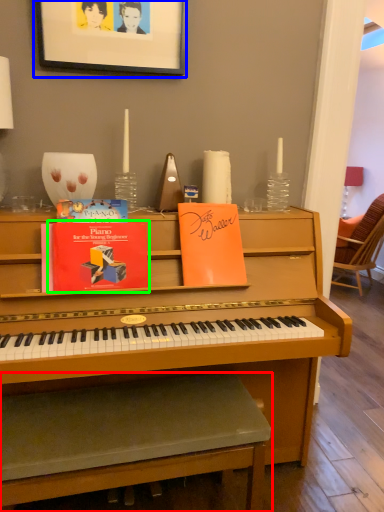
Question: Estimate the real-world distances between objects in this image. Which object is closer to music stool (highlighted by a red box), picture frame (highlighted by a blue box) or paperback book (highlighted by a green box)?

Choices:
 (A) picture frame
 (B) paperback book

Answer: (B)